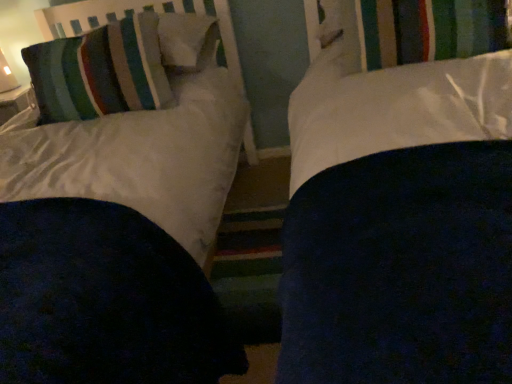
This screenshot has width=512, height=384. Describe the element at coordinates (429, 30) in the screenshot. I see `striped fabric curtain at upper center` at that location.

Locate an element on the screen. Image resolution: width=512 pixels, height=384 pixels. striped fabric curtain at upper center is located at coordinates (429, 30).

In order to face striped fabric headboard at upper left, should I rotate leftwards or rightwards?

It's best to rotate left around 16.649 degrees.

Where is `striped fabric headboard at upper left`? striped fabric headboard at upper left is located at coordinates (x=135, y=11).

This screenshot has width=512, height=384. Find the location of `striped fabric pillow at upper left`. striped fabric pillow at upper left is located at coordinates (100, 71).

Locate an element on the screen. The width and height of the screenshot is (512, 384). headboard on the right of striped fabric pillow at upper left is located at coordinates (135, 11).

Between striped fabric pillow at upper left and striped fabric headboard at upper left, which one appears on the right side from the viewer's perspective?

striped fabric headboard at upper left is more to the right.

From the picture: Is striped fabric pillow at upper left completely or partially outside of striped fabric headboard at upper left?

Yes.

Is point (102, 58) farther from viewer compared to point (102, 21)?

That is False.

Can you confirm if striped fabric curtain at upper center is smaller than striped fabric headboard at upper left?

Indeed, striped fabric curtain at upper center has a smaller size compared to striped fabric headboard at upper left.

Is striped fabric curtain at upper center oriented away from striped fabric headboard at upper left?

No.

Between striped fabric curtain at upper center and striped fabric headboard at upper left, which one is positioned behind?

striped fabric headboard at upper left is further from the camera.

How distant is striped fabric curtain at upper center from striped fabric headboard at upper left?

They are 1.05 meters apart.

From a real-world perspective, which is physically above, striped fabric headboard at upper left or striped fabric pillow at upper left?

In real-world perspective, striped fabric headboard at upper left is above.

Is striped fabric headboard at upper left to the right of striped fabric pillow at upper left from the viewer's perspective?

Yes, striped fabric headboard at upper left is to the right of striped fabric pillow at upper left.

Is striped fabric pillow at upper left located within striped fabric headboard at upper left?

No, striped fabric pillow at upper left is located outside of striped fabric headboard at upper left.

From a real-world perspective, who is located lower, striped fabric pillow at upper left or striped fabric curtain at upper center?

striped fabric curtain at upper center, from a real-world perspective.

From the image's perspective, would you say striped fabric pillow at upper left is shown under striped fabric curtain at upper center?

Yes.

In the scene shown: Can you confirm if striped fabric pillow at upper left is positioned to the left of striped fabric curtain at upper center?

Correct, you'll find striped fabric pillow at upper left to the left of striped fabric curtain at upper center.

Considering the sizes of objects striped fabric pillow at upper left and striped fabric curtain at upper center in the image provided, who is wider, striped fabric pillow at upper left or striped fabric curtain at upper center?

Wider between the two is striped fabric curtain at upper center.

Which is in front, striped fabric headboard at upper left or striped fabric curtain at upper center?

striped fabric curtain at upper center.

Based on the photo, is striped fabric headboard at upper left oriented away from striped fabric curtain at upper center?

Yes, striped fabric headboard at upper left is facing away from striped fabric curtain at upper center.

From the image's perspective, between striped fabric headboard at upper left and striped fabric curtain at upper center, which one is located above?

striped fabric headboard at upper left.

From the image's perspective, is striped fabric curtain at upper center located above or below striped fabric pillow at upper left?

From the image's perspective, striped fabric curtain at upper center appears above striped fabric pillow at upper left.

Considering the relative positions of striped fabric curtain at upper center and striped fabric pillow at upper left in the image provided, is striped fabric curtain at upper center to the left of striped fabric pillow at upper left from the viewer's perspective?

In fact, striped fabric curtain at upper center is to the right of striped fabric pillow at upper left.

Which object is closer to the camera, striped fabric curtain at upper center or striped fabric pillow at upper left?

striped fabric curtain at upper center is in front.

Which is nearer, (399, 4) or (117, 96)?

The point (399, 4) is closer to the camera.

Where is `pillow directly beneath the striped fabric headboard at upper left (from a real-world perspective)`? Image resolution: width=512 pixels, height=384 pixels. pillow directly beneath the striped fabric headboard at upper left (from a real-world perspective) is located at coordinates (100, 71).

The width and height of the screenshot is (512, 384). Find the location of `headboard that is behind the striped fabric curtain at upper center`. headboard that is behind the striped fabric curtain at upper center is located at coordinates (135, 11).

Looking at the image, which one is located further to striped fabric headboard at upper left, striped fabric pillow at upper left or striped fabric curtain at upper center?

striped fabric curtain at upper center.

From the image, which object appears to be nearer to striped fabric curtain at upper center, striped fabric pillow at upper left or striped fabric headboard at upper left?

Based on the image, striped fabric pillow at upper left appears to be nearer to striped fabric curtain at upper center.

When comparing their distances from striped fabric headboard at upper left, does striped fabric curtain at upper center or striped fabric pillow at upper left seem further?

striped fabric curtain at upper center is positioned further to the anchor striped fabric headboard at upper left.

Estimate the real-world distances between objects in this image. Which object is closer to striped fabric curtain at upper center, striped fabric headboard at upper left or striped fabric pillow at upper left?

striped fabric pillow at upper left.

When comparing their distances from striped fabric pillow at upper left, does striped fabric headboard at upper left or striped fabric curtain at upper center seem further?

Among the two, striped fabric curtain at upper center is located further to striped fabric pillow at upper left.

Considering their positions, is striped fabric curtain at upper center positioned closer to striped fabric pillow at upper left than striped fabric headboard at upper left?

striped fabric headboard at upper left is closer to striped fabric pillow at upper left.

The image size is (512, 384). I want to click on headboard located between striped fabric pillow at upper left and striped fabric curtain at upper center in the left-right direction, so click(x=135, y=11).